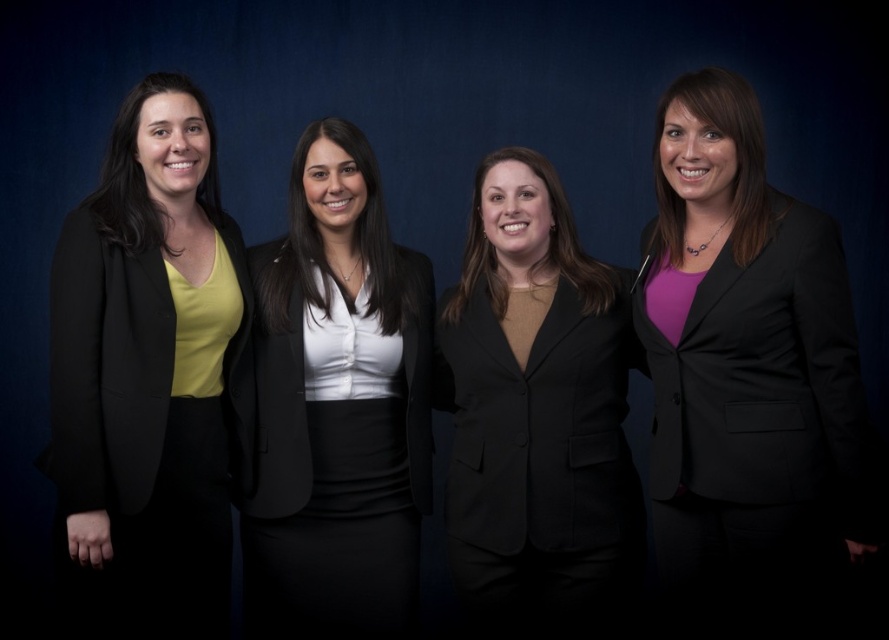
You are a photographer arranging a group photo. You have two blazers in the scene, the purple matte blazer at right and the matte black blazer at center. Which blazer is narrower?

The purple matte blazer at right is narrower than the matte black blazer at center.

You are standing in front of the group photo of four women. You notice two points marked on the image at coordinates point (645, 321) and point (401, 528). Based on the perspective of the photo, which point is closer to you?

Point (645, 321) is closer to the viewer than point (401, 528).

You are a photographer adjusting the lighting for a group photo. You notice a point at coordinates point (745, 378) which is part of the purple matte blazer at right. Where should you direct the light to ensure the purple matte blazer at right is well lit?

The point (745, 378) is part of the purple matte blazer at right, so directing the light towards the purple matte blazer at right will ensure it is well lit.